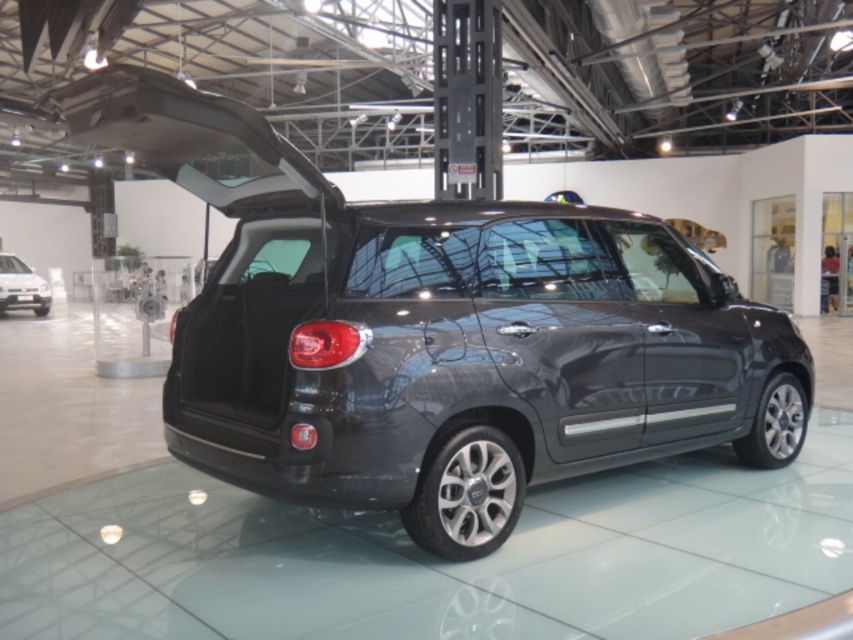
Which is more to the left, satin black car at center or matte black car at lower left?

matte black car at lower left is more to the left.

Who is positioned more to the right, satin black car at center or matte black car at lower left?

satin black car at center

Locate an element on the screen. The width and height of the screenshot is (853, 640). satin black car at center is located at coordinates (436, 332).